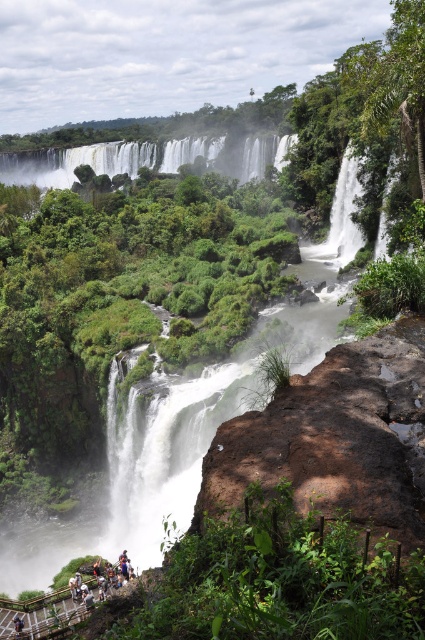
Question: Which object is the farthest from the dark blue jeans at lower left?

Choices:
 (A) white frothy water at center
 (B) white cotton shirt at lower left

Answer: (A)

Question: Which of these objects is positioned closest to the white frothy water at center?

Choices:
 (A) white cotton shirt at lower left
 (B) dark blue jeans at lower left

Answer: (B)

Question: Does white cotton shirt at lower left lie in front of dark blue jeans at lower left?

Choices:
 (A) no
 (B) yes

Answer: (A)

Question: Can you confirm if white frothy water at center is thinner than dark blue jeans at lower left?

Choices:
 (A) no
 (B) yes

Answer: (A)

Question: Among these objects, which one is farthest from the camera?

Choices:
 (A) dark blue jeans at lower left
 (B) white frothy water at center
 (C) white cotton shirt at lower left

Answer: (B)

Question: Does white frothy water at center appear under white cotton shirt at lower left?

Choices:
 (A) yes
 (B) no

Answer: (B)